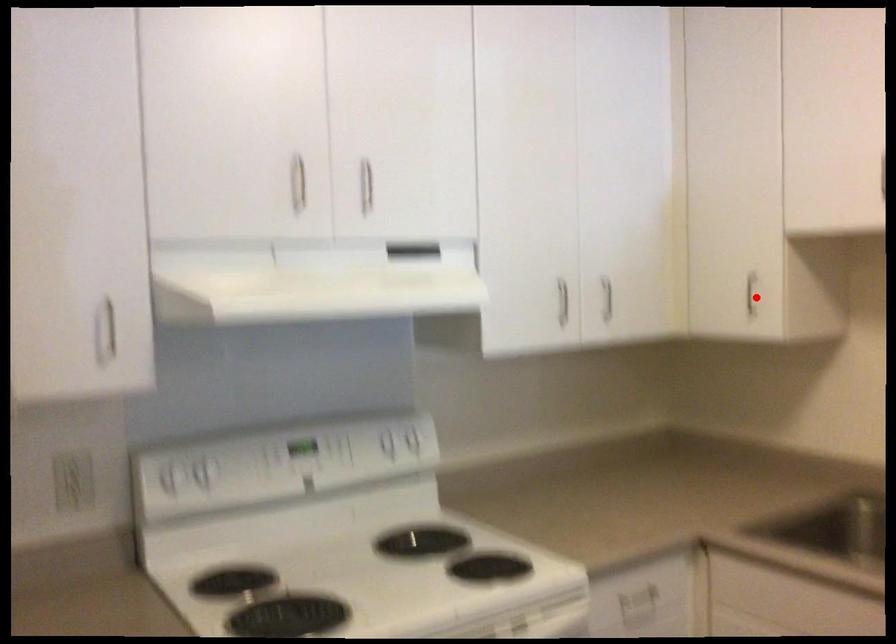
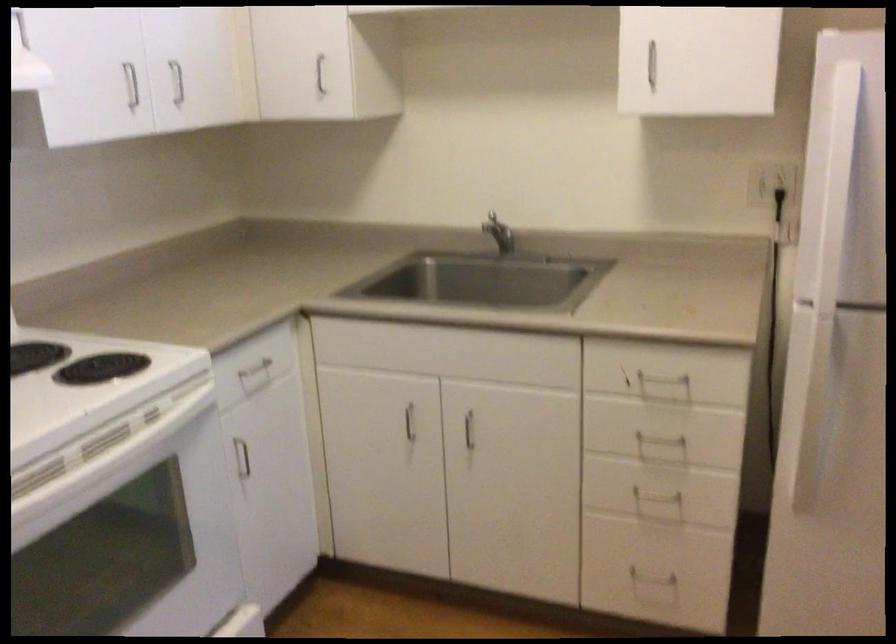
The point at the highlighted location is marked in the first image. Where is the corresponding point in the second image?

(319, 75)